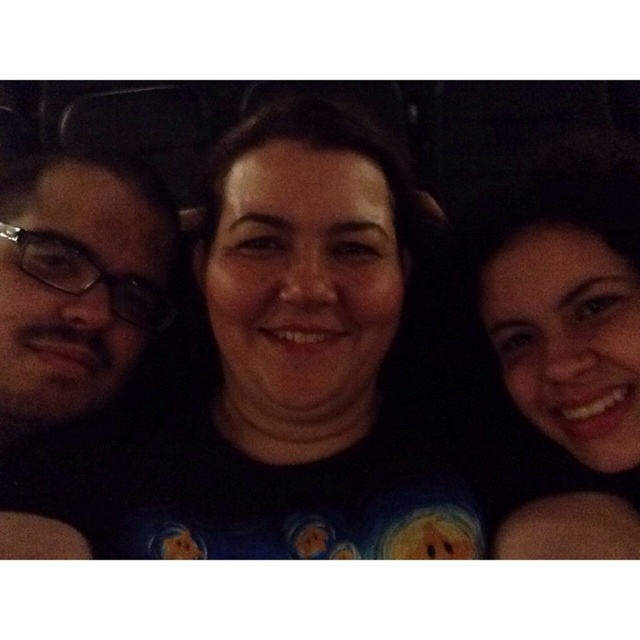
Question: Does smooth skin at right appear over dark matte glasses at left?

Choices:
 (A) yes
 (B) no

Answer: (B)

Question: Which point is closer to the camera taking this photo?

Choices:
 (A) (600, 340)
 (B) (148, 472)
 (C) (67, 284)

Answer: (A)

Question: Is smooth skin at right above transparent plastic glasses at left?

Choices:
 (A) no
 (B) yes

Answer: (A)

Question: Estimate the real-world distances between objects in this image. Which object is closer to the smooth skin at right?

Choices:
 (A) black matte shirt at center
 (B) transparent plastic glasses at left

Answer: (A)

Question: Is smooth skin at right below transparent plastic glasses at left?

Choices:
 (A) yes
 (B) no

Answer: (A)

Question: Estimate the real-world distances between objects in this image. Which object is closer to the transparent plastic glasses at left?

Choices:
 (A) dark matte glasses at left
 (B) smooth skin at right

Answer: (A)